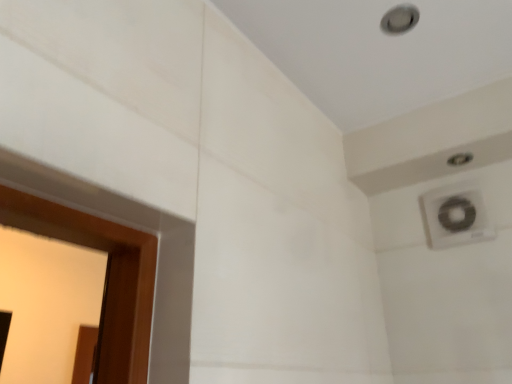
Question: Considering the positions of point (434, 238) and point (399, 23), is point (434, 238) closer or farther from the camera than point (399, 23)?

Choices:
 (A) closer
 (B) farther

Answer: (B)

Question: Do you think white plastic air conditioning at upper right is within matte silver hole at upper right, or outside of it?

Choices:
 (A) inside
 (B) outside

Answer: (B)

Question: Considering the positions of white plastic air conditioning at upper right and matte silver hole at upper right in the image, is white plastic air conditioning at upper right wider or thinner than matte silver hole at upper right?

Choices:
 (A) thin
 (B) wide

Answer: (A)

Question: In terms of height, does matte silver hole at upper right look taller or shorter compared to white plastic air conditioning at upper right?

Choices:
 (A) short
 (B) tall

Answer: (A)

Question: Do you think matte silver hole at upper right is within white plastic air conditioning at upper right, or outside of it?

Choices:
 (A) inside
 (B) outside

Answer: (B)

Question: Looking at their shapes, would you say matte silver hole at upper right is wider or thinner than white plastic air conditioning at upper right?

Choices:
 (A) wide
 (B) thin

Answer: (A)

Question: From the image's perspective, is matte silver hole at upper right located above or below white plastic air conditioning at upper right?

Choices:
 (A) above
 (B) below

Answer: (A)